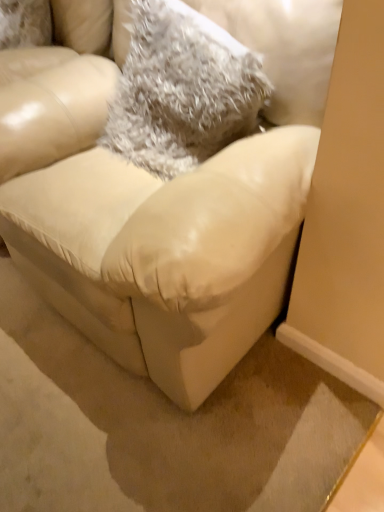
Question: Is matte leather couch at center not inside fuzzy gray throw pillow at upper center?

Choices:
 (A) no
 (B) yes

Answer: (B)

Question: Does matte leather couch at center appear on the left side of fuzzy gray throw pillow at upper center?

Choices:
 (A) no
 (B) yes

Answer: (B)

Question: Could you tell me if matte leather couch at center is turned towards fuzzy gray throw pillow at upper center?

Choices:
 (A) no
 (B) yes

Answer: (B)

Question: Is matte leather couch at center surrounding fuzzy gray throw pillow at upper center?

Choices:
 (A) yes
 (B) no

Answer: (A)

Question: Is matte leather couch at center at the right side of fuzzy gray throw pillow at upper center?

Choices:
 (A) yes
 (B) no

Answer: (B)

Question: Would you consider matte leather couch at center to be distant from fuzzy gray throw pillow at upper center?

Choices:
 (A) yes
 (B) no

Answer: (B)

Question: From the image's perspective, is fuzzy gray throw pillow at upper center on top of matte leather couch at center?

Choices:
 (A) no
 (B) yes

Answer: (B)

Question: Is fuzzy gray throw pillow at upper center looking in the opposite direction of matte leather couch at center?

Choices:
 (A) no
 (B) yes

Answer: (B)

Question: Is the depth of fuzzy gray throw pillow at upper center greater than that of matte leather couch at center?

Choices:
 (A) no
 (B) yes

Answer: (B)

Question: Considering the relative sizes of fuzzy gray throw pillow at upper center and matte leather couch at center in the image provided, is fuzzy gray throw pillow at upper center wider than matte leather couch at center?

Choices:
 (A) yes
 (B) no

Answer: (B)

Question: From a real-world perspective, is fuzzy gray throw pillow at upper center under matte leather couch at center?

Choices:
 (A) no
 (B) yes

Answer: (A)

Question: Can you confirm if fuzzy gray throw pillow at upper center is taller than matte leather couch at center?

Choices:
 (A) no
 (B) yes

Answer: (A)

Question: Is fuzzy gray throw pillow at upper center in front of or behind matte leather couch at center in the image?

Choices:
 (A) behind
 (B) front

Answer: (A)